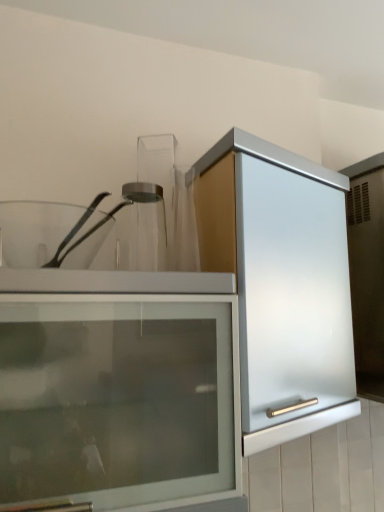
Question: Is satin silver cabinet at center far from clear glass jar at center?

Choices:
 (A) yes
 (B) no

Answer: (B)

Question: From the image's perspective, is satin silver cabinet at center above clear glass jar at center?

Choices:
 (A) no
 (B) yes

Answer: (A)

Question: Can you confirm if satin silver cabinet at center is bigger than clear glass jar at center?

Choices:
 (A) yes
 (B) no

Answer: (A)

Question: Is satin silver cabinet at center surrounding clear glass jar at center?

Choices:
 (A) yes
 (B) no

Answer: (B)

Question: Considering the relative sizes of satin silver cabinet at center and clear glass jar at center in the image provided, is satin silver cabinet at center smaller than clear glass jar at center?

Choices:
 (A) yes
 (B) no

Answer: (B)

Question: Is satin silver cabinet at center not inside clear glass jar at center?

Choices:
 (A) yes
 (B) no

Answer: (A)

Question: Would you say clear glass jar at center is outside satin silver cabinet at center?

Choices:
 (A) yes
 (B) no

Answer: (A)

Question: Are clear glass jar at center and satin silver cabinet at center far apart?

Choices:
 (A) no
 (B) yes

Answer: (A)

Question: Does clear glass jar at center have a greater width compared to satin silver cabinet at center?

Choices:
 (A) yes
 (B) no

Answer: (B)

Question: Considering the relative sizes of clear glass jar at center and satin silver cabinet at center in the image provided, is clear glass jar at center smaller than satin silver cabinet at center?

Choices:
 (A) yes
 (B) no

Answer: (A)

Question: Is satin silver cabinet at center surrounded by clear glass jar at center?

Choices:
 (A) yes
 (B) no

Answer: (B)

Question: Is clear glass jar at center next to satin silver cabinet at center?

Choices:
 (A) no
 (B) yes

Answer: (A)

Question: Relative to clear glass jar at center, is satin silver cabinet at center in front or behind?

Choices:
 (A) front
 (B) behind

Answer: (A)